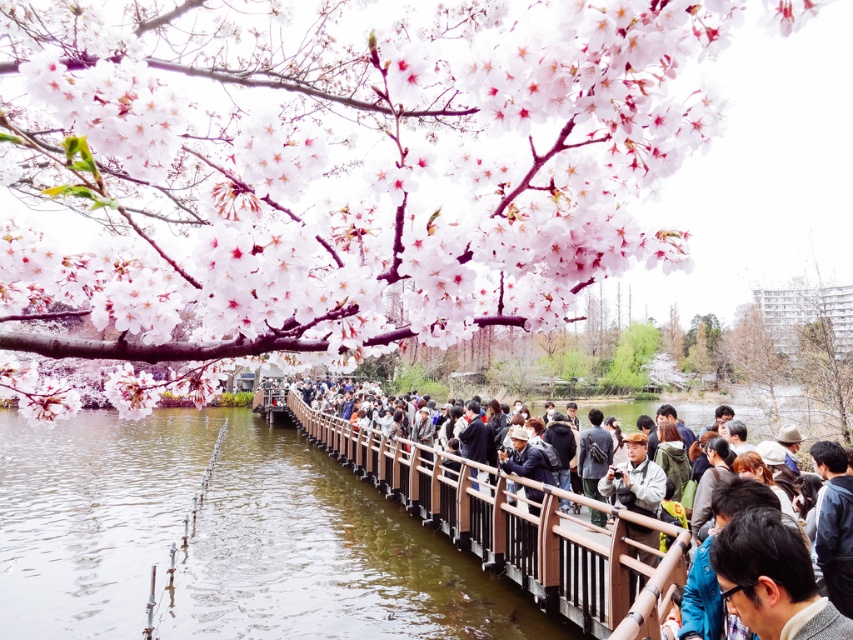
From the picture: You are a photographer trying to capture the pink blossoms at upper left and the brown wooden rail at center in the same frame. Based on their sizes, which object would appear larger in your photo?

The pink blossoms at upper left might appear larger in the photo since they are wider than the brown wooden rail at center.

In the scene shown: You are standing on the wooden walkway and want to take a photo of the pink blossoms at upper left and the brown wooden rail at center. To capture both in the frame, should you adjust your camera to the left or right side of the walkway?

The pink blossoms at upper left is positioned on the left side of brown wooden rail at center, so you should move your camera to the left side of the walkway to include both objects in the frame.

You are standing at the center of the wooden walkway and want to take a photo of the pink blossoms at upper left. In which direction should you point your camera to capture them?

The pink blossoms at upper left are located at point coordinates approximately 0.263 on the x and 0.397 on the y axis, so you should point your camera towards the upper left direction to capture them.